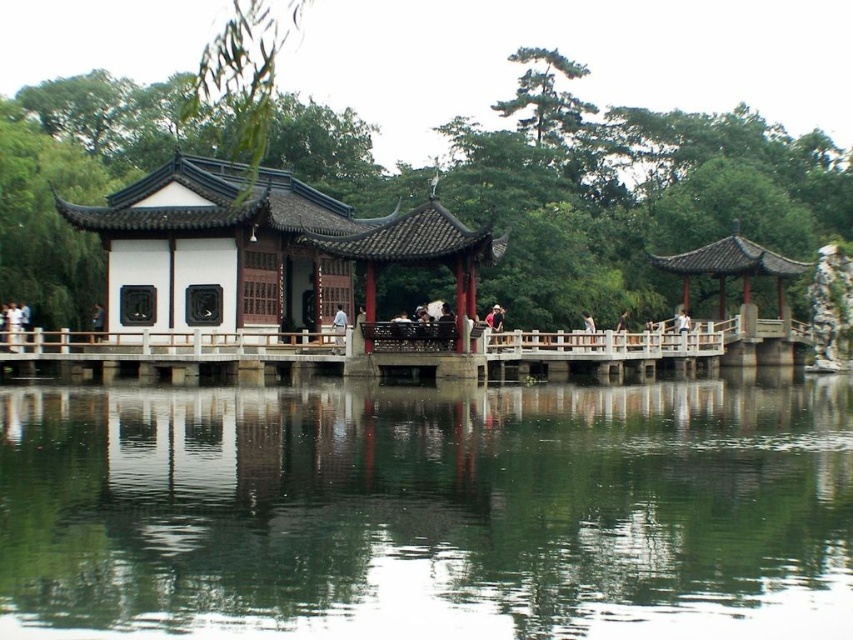
Consider the image. You are standing on the wooden bridge connecting the two pavilions. You notice the white wooden pavilion at center and the matte black person at center. Which object is closer to you based on their positions?

The matte black person at center is closer to you because the white wooden pavilion at center is positioned over them, indicating it is further away.

You are standing at the pavilion on the stone platform. You want to cross to the other pavilion. The wooden bridge is your only path. However, there is a point marked at coordinates (427, 512) in the scene. What is the significance of this point in relation to the green reflective water at center?

The point (427, 512) represents the location of the green reflective water at center in the scene.